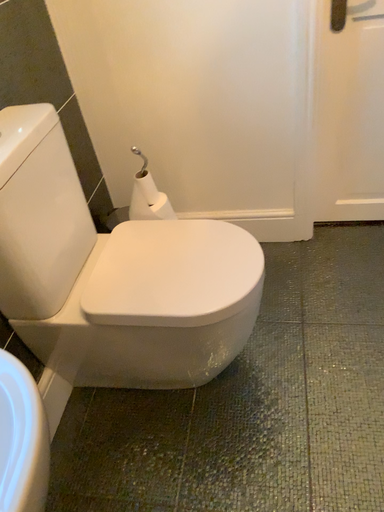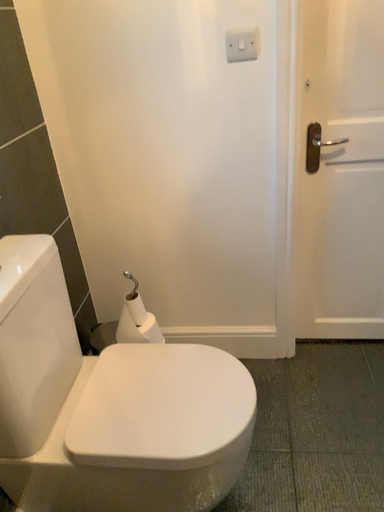
Question: Which way did the camera rotate in the video?

Choices:
 (A) rotated downward
 (B) rotated upward

Answer: (B)